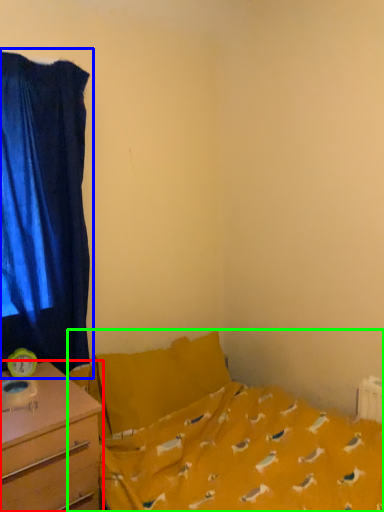
Question: Which is farther away from desk (highlighted by a red box)? curtain (highlighted by a blue box) or bed (highlighted by a green box)?

Choices:
 (A) curtain
 (B) bed

Answer: (A)